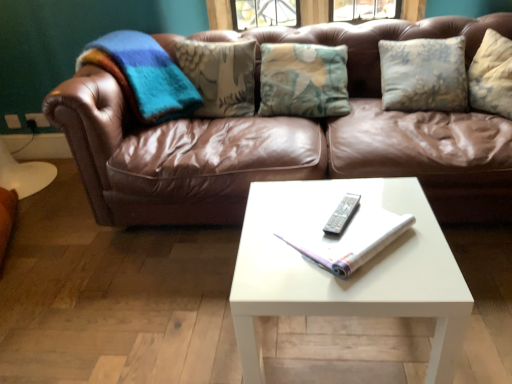
Identify the location of unoccupied area in front of white paper book at center. This screenshot has width=512, height=384. (369, 280).